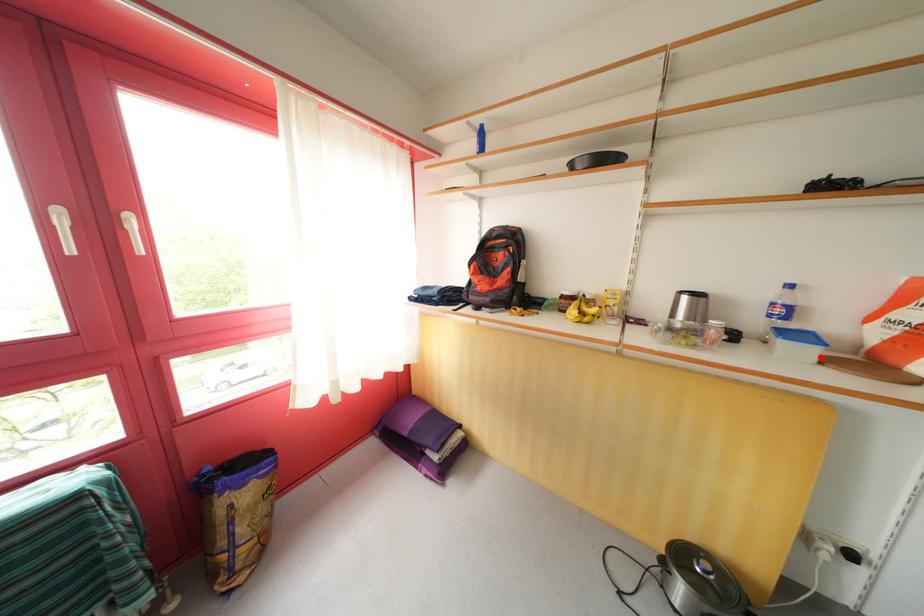
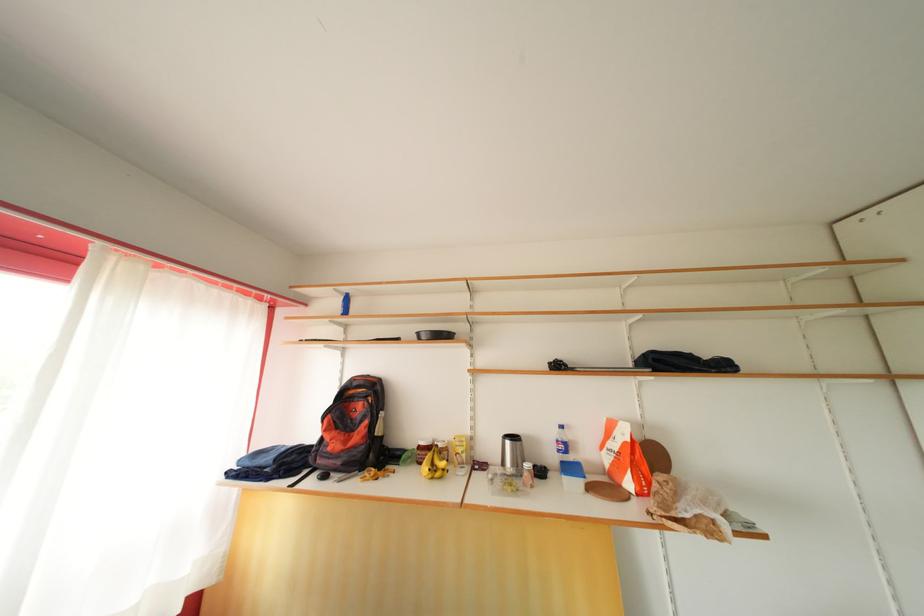
Find the pixel in the second image that matches the highlighted location in the first image.

(587, 488)